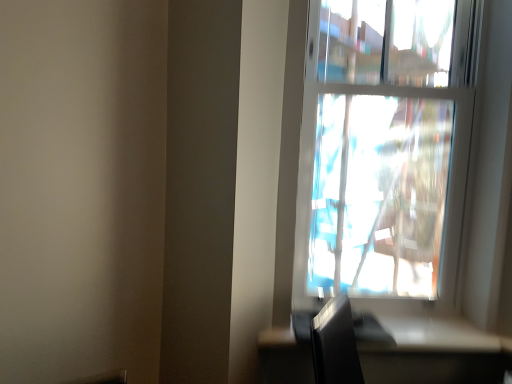
Question: Does satin black table at lower right come behind transparent glass window at upper right?

Choices:
 (A) no
 (B) yes

Answer: (A)

Question: Would you say satin black table at lower right is outside transparent glass window at upper right?

Choices:
 (A) no
 (B) yes

Answer: (B)

Question: Could you tell me if satin black table at lower right is turned towards transparent glass window at upper right?

Choices:
 (A) yes
 (B) no

Answer: (B)

Question: Considering the relative sizes of satin black table at lower right and transparent glass window at upper right in the image provided, is satin black table at lower right smaller than transparent glass window at upper right?

Choices:
 (A) yes
 (B) no

Answer: (A)

Question: From the image's perspective, is satin black table at lower right located beneath transparent glass window at upper right?

Choices:
 (A) yes
 (B) no

Answer: (A)

Question: Can you confirm if satin black table at lower right is thinner than transparent glass window at upper right?

Choices:
 (A) no
 (B) yes

Answer: (A)

Question: Can you confirm if transparent glass window at upper right is thinner than satin black table at lower right?

Choices:
 (A) no
 (B) yes

Answer: (B)

Question: Is the depth of transparent glass window at upper right greater than that of satin black table at lower right?

Choices:
 (A) yes
 (B) no

Answer: (A)

Question: Is transparent glass window at upper right completely or partially outside of satin black table at lower right?

Choices:
 (A) no
 (B) yes

Answer: (B)

Question: Is transparent glass window at upper right bigger than satin black table at lower right?

Choices:
 (A) no
 (B) yes

Answer: (B)

Question: Is transparent glass window at upper right not near satin black table at lower right?

Choices:
 (A) no
 (B) yes

Answer: (B)

Question: Does transparent glass window at upper right come in front of satin black table at lower right?

Choices:
 (A) no
 (B) yes

Answer: (A)

Question: Is satin black table at lower right inside the boundaries of transparent glass window at upper right, or outside?

Choices:
 (A) inside
 (B) outside

Answer: (B)